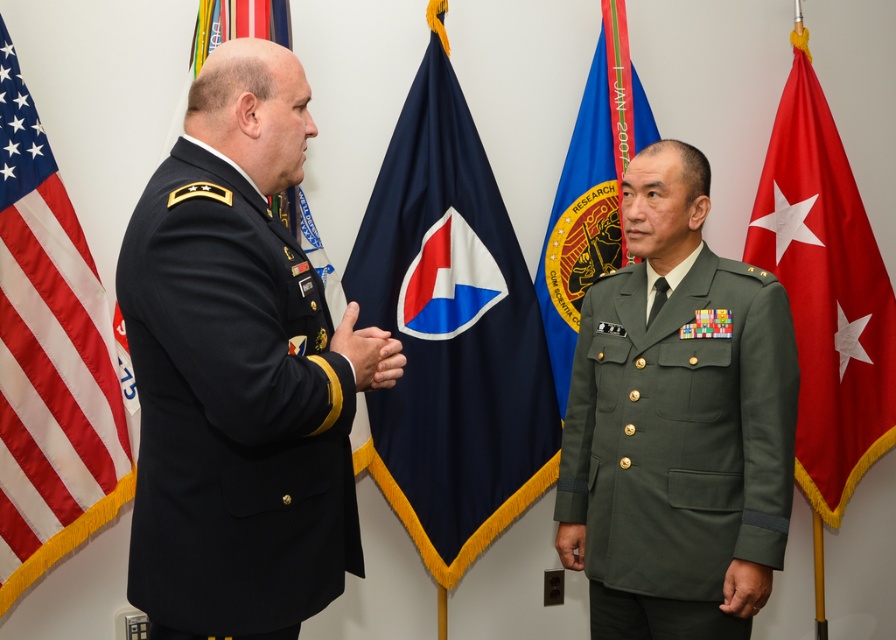
Question: Which point appears farthest from the camera in this image?

Choices:
 (A) (561, 284)
 (B) (660, 582)
 (C) (397, 365)
 (D) (826, 390)

Answer: (D)

Question: Which of the following is the farthest from the observer?

Choices:
 (A) matte black hand at center
 (B) red fabric flag at right
 (C) red/white striped fabric at left

Answer: (B)

Question: Considering the relative positions of blue fabric flag at upper left and matte black hand at center in the image provided, where is blue fabric flag at upper left located with respect to matte black hand at center?

Choices:
 (A) right
 (B) left

Answer: (B)

Question: Can you confirm if red/white striped fabric at left is bigger than matte black hand at center?

Choices:
 (A) yes
 (B) no

Answer: (A)

Question: Can you confirm if black fabric uniform at left is positioned to the right of blue fabric flag at upper left?

Choices:
 (A) no
 (B) yes

Answer: (B)

Question: Which of the following is the farthest from the observer?

Choices:
 (A) (599, 442)
 (B) (261, 490)
 (C) (401, 180)

Answer: (C)